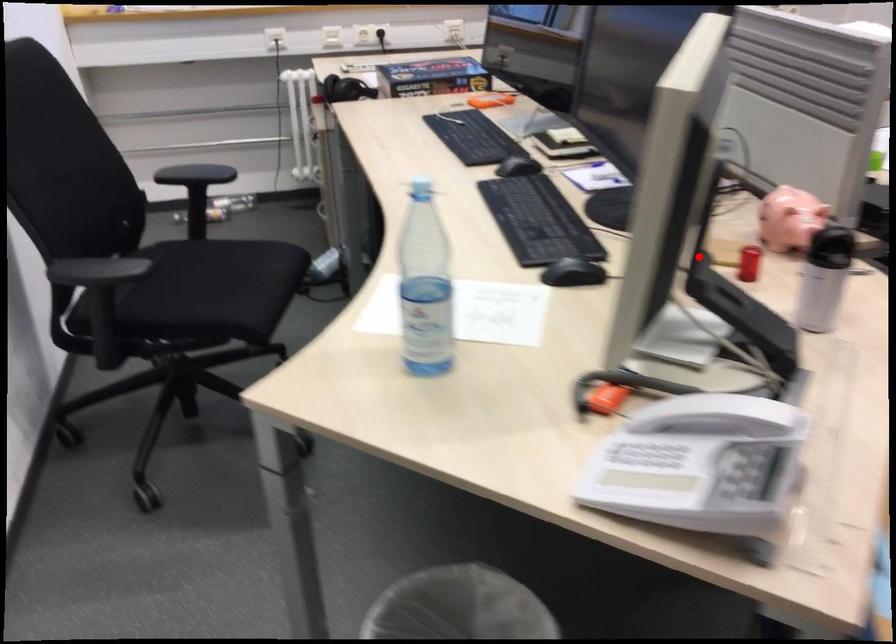
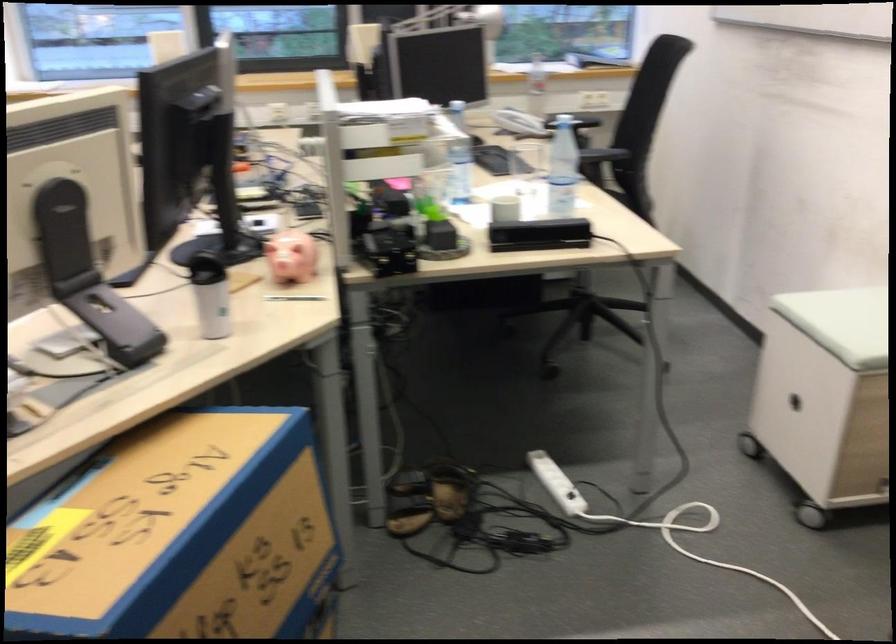
Locate, in the second image, the point that corresponds to the highlighted location in the first image.

(88, 275)